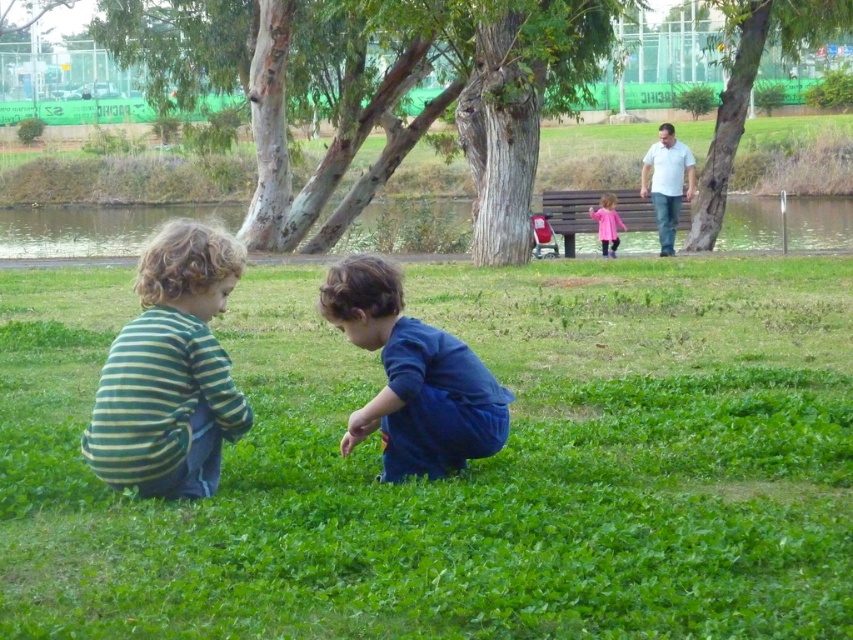
Question: Which point is closer to the camera taking this photo?

Choices:
 (A) (389, 417)
 (B) (541, 323)
 (C) (619, 225)

Answer: (A)

Question: Is white cotton shirt at upper right below pink fabric dress at center?

Choices:
 (A) no
 (B) yes

Answer: (A)

Question: Among these points, which one is nearest to the camera?

Choices:
 (A) (454, 372)
 (B) (669, 212)

Answer: (A)

Question: Considering the relative positions of green soft grass at center and green striped shirt at left in the image provided, where is green soft grass at center located with respect to green striped shirt at left?

Choices:
 (A) below
 (B) above

Answer: (A)

Question: Does green striped shirt at left appear over pink fabric dress at center?

Choices:
 (A) yes
 (B) no

Answer: (B)

Question: Which object is farther from the camera taking this photo?

Choices:
 (A) green striped shirt at left
 (B) white cotton shirt at upper right

Answer: (B)